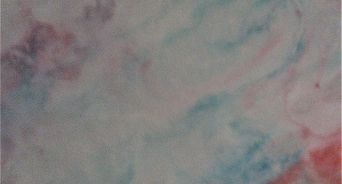
This screenshot has width=342, height=184. What are the coordinates of `paint` in the screenshot? It's located at (152, 26), (276, 87), (123, 170), (14, 65), (319, 161), (178, 121).